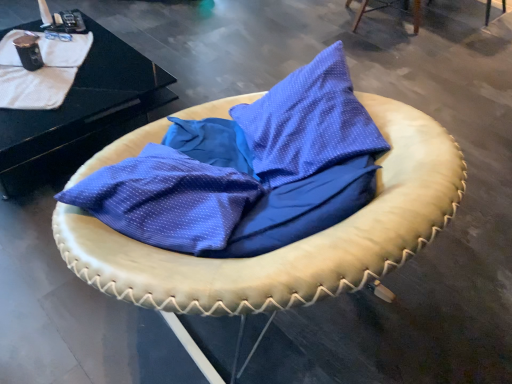
Locate an element on the screen. This screenshot has height=384, width=512. free space above black glossy table at upper left (from a real-world perspective) is located at coordinates (64, 74).